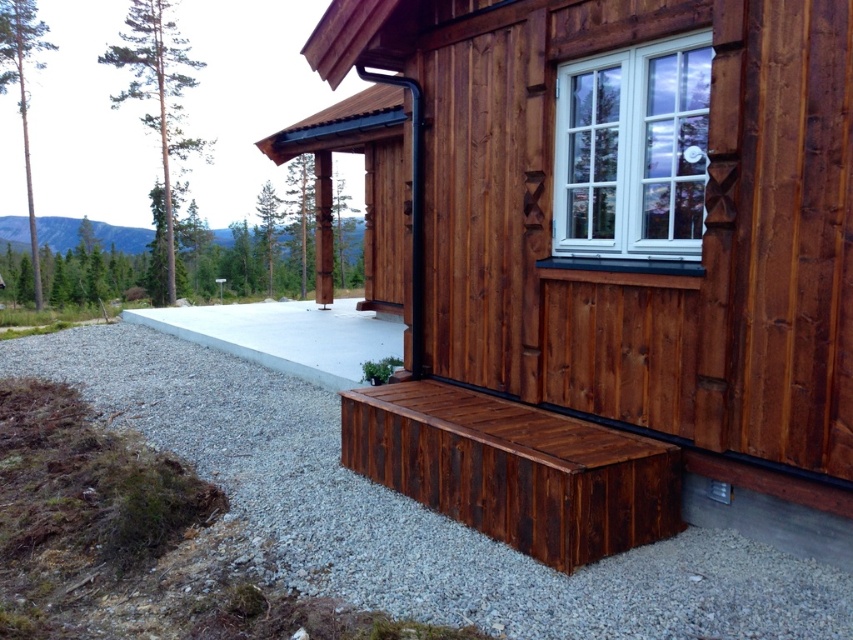
Question: Does dark brown wood bench at lower right appear over white plastic window at upper center?

Choices:
 (A) yes
 (B) no

Answer: (B)

Question: Estimate the real-world distances between objects in this image. Which object is closer to the dark brown wood bench at lower right?

Choices:
 (A) dark brown wood bench at lower center
 (B) white plastic window at upper center
 (C) gray gravel at lower left

Answer: (C)

Question: In this image, where is dark brown wood bench at lower center located relative to white plastic window at upper center?

Choices:
 (A) above
 (B) below

Answer: (B)

Question: Can you confirm if dark brown wood bench at lower right is positioned above white plastic window at upper center?

Choices:
 (A) no
 (B) yes

Answer: (A)

Question: Which object is farther from the camera taking this photo?

Choices:
 (A) white plastic window at upper center
 (B) dark brown wood bench at lower right
 (C) dark brown wood bench at lower center

Answer: (C)

Question: Which point is closer to the camera?

Choices:
 (A) pyautogui.click(x=248, y=435)
 (B) pyautogui.click(x=653, y=216)
 (C) pyautogui.click(x=440, y=355)
 (D) pyautogui.click(x=500, y=502)

Answer: (D)